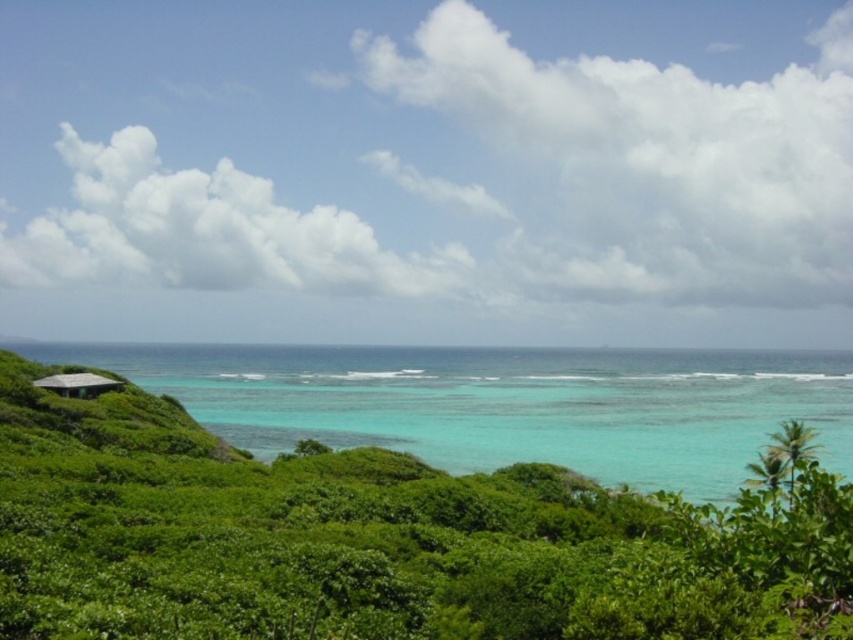
You are a photographer planning to capture a wide shot of the coastal landscape. You want to include both the clear blue water at left and the gray concrete hut at lower left in your frame. Based on their sizes, which object should you focus on to ensure both are visible without cropping?

The clear blue water at left is larger in size compared to the gray concrete hut at lower left. To include both without cropping, focus on the clear blue water at left as it occupies more space, allowing the smaller gray concrete hut at lower left to fit naturally within the frame.